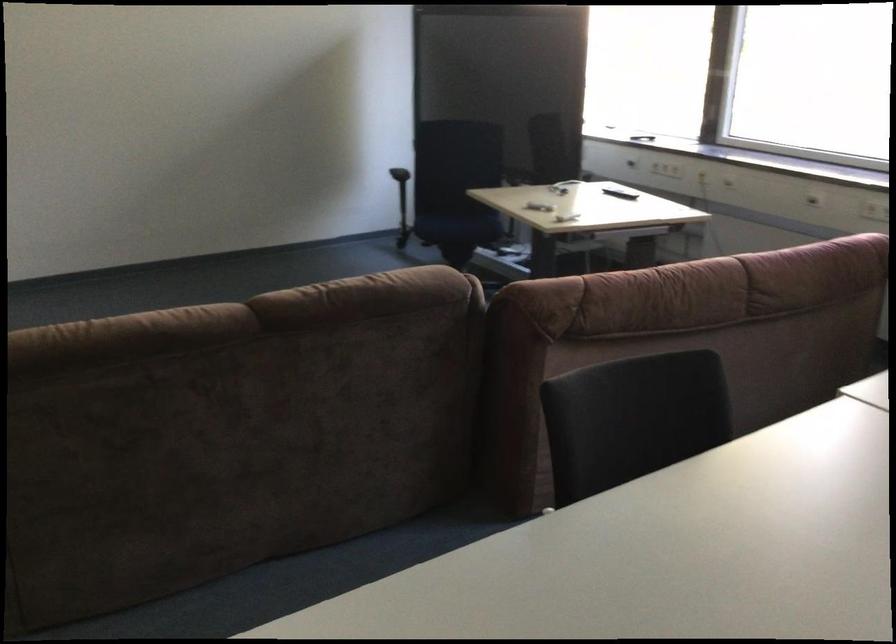
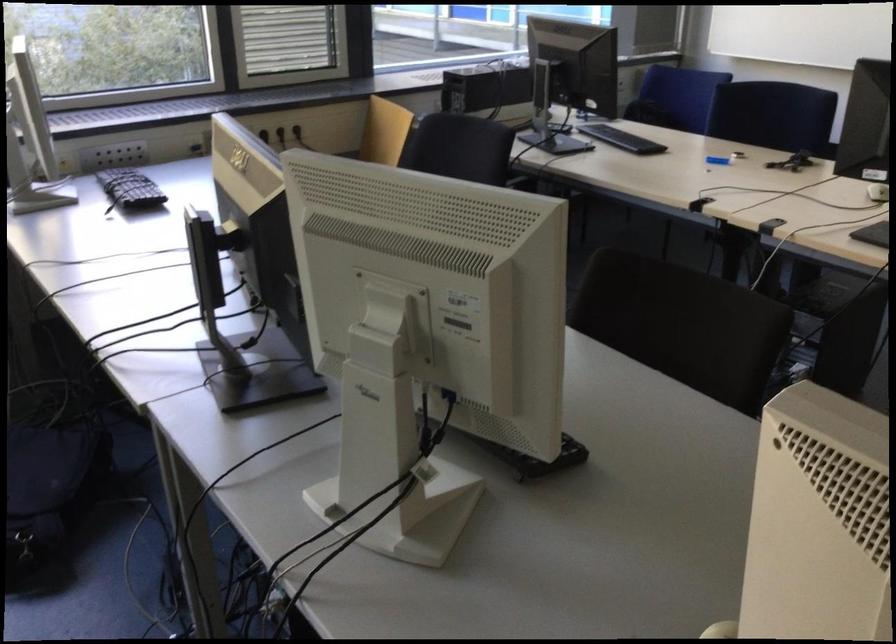
First-person continuous shooting, in which direction is the camera rotating?

The camera rotated toward right-down.